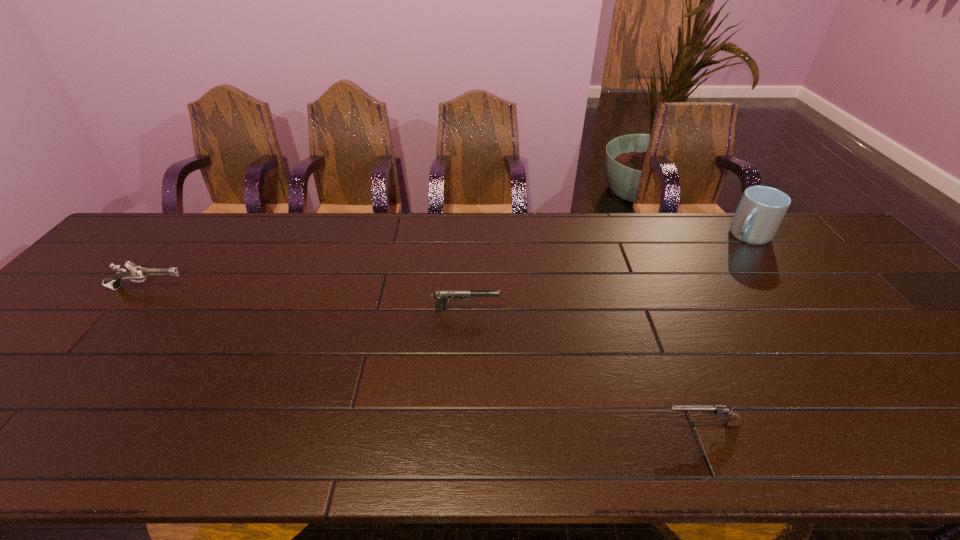
At what (x,y) coordinates should I click in order to perform the action: click on object that can be found as the second closest to the second gun from left to right. Please return your answer as a coordinate pair (x, y). Looking at the image, I should click on (133, 272).

Locate which object is the second closest to the tallest object. Please provide its 2D coordinates. Your answer should be formatted as a tuple, i.e. [(x, y)], where the tuple contains the x and y coordinates of a point satisfying the conditions above.

[(442, 296)]

What are the coordinates of `gun that stands as the third closest to the tallest object` in the screenshot? It's located at (133, 272).

I want to click on gun that stands as the third closest to the farthest object, so click(133, 272).